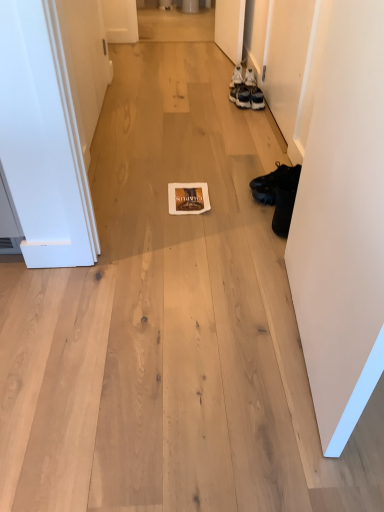
Question: Is white matte door at right, acting as the first door starting from the front, not close to white leather sneakers at upper right, acting as the 1th footwear starting from the top?

Choices:
 (A) yes
 (B) no

Answer: (A)

Question: Would you say white leather sneakers at upper right, which ranks as the 1th footwear in back-to-front order, is part of white matte door at right, acting as the first door starting from the front,'s contents?

Choices:
 (A) yes
 (B) no

Answer: (B)

Question: Is white matte door at right, acting as the first door starting from the front, to the left of white leather sneakers at upper right, which ranks as the 1th footwear in back-to-front order, from the viewer's perspective?

Choices:
 (A) yes
 (B) no

Answer: (B)

Question: Can you confirm if white matte door at right, acting as the first door starting from the front, is taller than white leather sneakers at upper right, acting as the 1th footwear starting from the top?

Choices:
 (A) yes
 (B) no

Answer: (A)

Question: Does white matte door at right, the 2th door when ordered from back to front, have a larger size compared to white leather sneakers at upper right, acting as the 1th footwear starting from the top?

Choices:
 (A) yes
 (B) no

Answer: (A)

Question: In the image, is black leather boot at right, the 1th footwear positioned from the front, positioned in front of or behind black leather boot at right, placed as the 2th footwear when sorted from bottom to top?

Choices:
 (A) behind
 (B) front

Answer: (B)

Question: Considering the positions of point (274, 226) and point (256, 177), is point (274, 226) closer or farther from the camera than point (256, 177)?

Choices:
 (A) farther
 (B) closer

Answer: (B)

Question: Is black leather boot at right, which is the fourth footwear from back to front, wider or thinner than black leather boot at right, placed as the 2th footwear when sorted from bottom to top?

Choices:
 (A) wide
 (B) thin

Answer: (B)

Question: Based on their positions, is black leather boot at right, marked as the first footwear in a bottom-to-top arrangement, located to the left or right of black leather boot at right, which is counted as the 3th footwear, starting from the top?

Choices:
 (A) right
 (B) left

Answer: (B)

Question: Does point (276, 226) appear closer or farther from the camera than point (236, 71)?

Choices:
 (A) farther
 (B) closer

Answer: (B)

Question: From the image's perspective, is black leather boot at right, the fourth footwear when ordered from top to bottom, above or below white leather sneakers at upper right, acting as the 1th footwear starting from the top?

Choices:
 (A) below
 (B) above

Answer: (A)

Question: From a real-world perspective, relative to white leather sneakers at upper right, acting as the 1th footwear starting from the top, is black leather boot at right, marked as the first footwear in a bottom-to-top arrangement, vertically above or below?

Choices:
 (A) below
 (B) above

Answer: (A)

Question: Would you say black leather boot at right, the fourth footwear when ordered from top to bottom, is inside or outside white leather sneakers at upper right, acting as the 1th footwear starting from the top?

Choices:
 (A) outside
 (B) inside

Answer: (A)

Question: Based on their positions, is matte black sneakers at upper right, which is the 3th footwear from bottom to top, located to the left or right of matte brown magazine at center?

Choices:
 (A) right
 (B) left

Answer: (A)

Question: Is matte black sneakers at upper right, which is the third footwear from front to back, spatially inside matte brown magazine at center, or outside of it?

Choices:
 (A) inside
 (B) outside

Answer: (B)